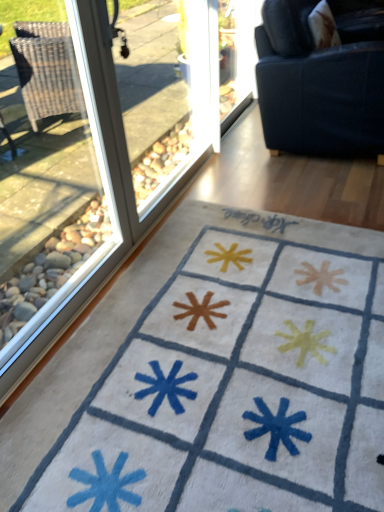
Question: Is dark blue fabric couch at upper right taller than white soft rug at lower center?

Choices:
 (A) no
 (B) yes

Answer: (B)

Question: Does dark blue fabric couch at upper right have a lesser height compared to white soft rug at lower center?

Choices:
 (A) no
 (B) yes

Answer: (A)

Question: Is dark blue fabric couch at upper right positioned behind white soft rug at lower center?

Choices:
 (A) no
 (B) yes

Answer: (B)

Question: Is dark blue fabric couch at upper right bigger than white soft rug at lower center?

Choices:
 (A) yes
 (B) no

Answer: (A)

Question: From a real-world perspective, does dark blue fabric couch at upper right stand above white soft rug at lower center?

Choices:
 (A) no
 (B) yes

Answer: (B)

Question: Is dark blue fabric couch at upper right not inside white soft rug at lower center?

Choices:
 (A) yes
 (B) no

Answer: (A)

Question: Does white soft rug at lower center appear on the right side of dark blue fabric couch at upper right?

Choices:
 (A) yes
 (B) no

Answer: (B)

Question: Is white soft rug at lower center closer to the viewer compared to dark blue fabric couch at upper right?

Choices:
 (A) no
 (B) yes

Answer: (B)

Question: Does white soft rug at lower center have a greater height compared to dark blue fabric couch at upper right?

Choices:
 (A) no
 (B) yes

Answer: (A)

Question: Does white soft rug at lower center have a lesser height compared to dark blue fabric couch at upper right?

Choices:
 (A) no
 (B) yes

Answer: (B)

Question: Is white soft rug at lower center smaller than dark blue fabric couch at upper right?

Choices:
 (A) no
 (B) yes

Answer: (B)

Question: Can you confirm if white soft rug at lower center is thinner than dark blue fabric couch at upper right?

Choices:
 (A) no
 (B) yes

Answer: (A)

Question: Does transparent glass screen door at upper center turn towards transparent glass window at left?

Choices:
 (A) no
 (B) yes

Answer: (A)